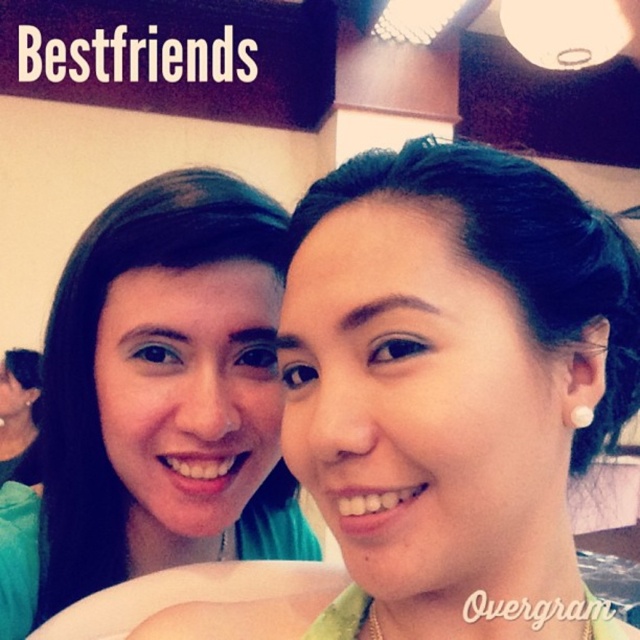
You are taking a selfie with two friends wearing matte green shirts. The person on the left is wearing a matte green shirt at left, and the person on the right is wearing a matte green shirt at center. Based on the scene, which person is wearing a wider shirt?

The matte green shirt at center is wider than the matte green shirt at left, so the person on the right is wearing the wider shirt.

You are taking a selfie with two friends wearing matte green shirts. The person on the left is wearing a matte green shirt at left, and the one in the center is wearing a matte green shirt at center. Based on the scene, which shirt is positioned to the right of the other?

The matte green shirt at center is to the right of the matte green shirt at left.